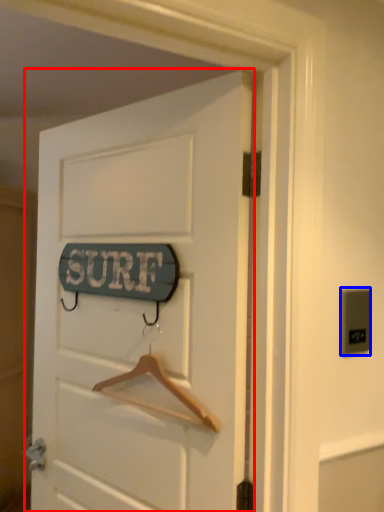
Question: Which object appears farthest to the camera in this image, door (highlighted by a red box) or electric outlet (highlighted by a blue box)?

Choices:
 (A) door
 (B) electric outlet

Answer: (B)